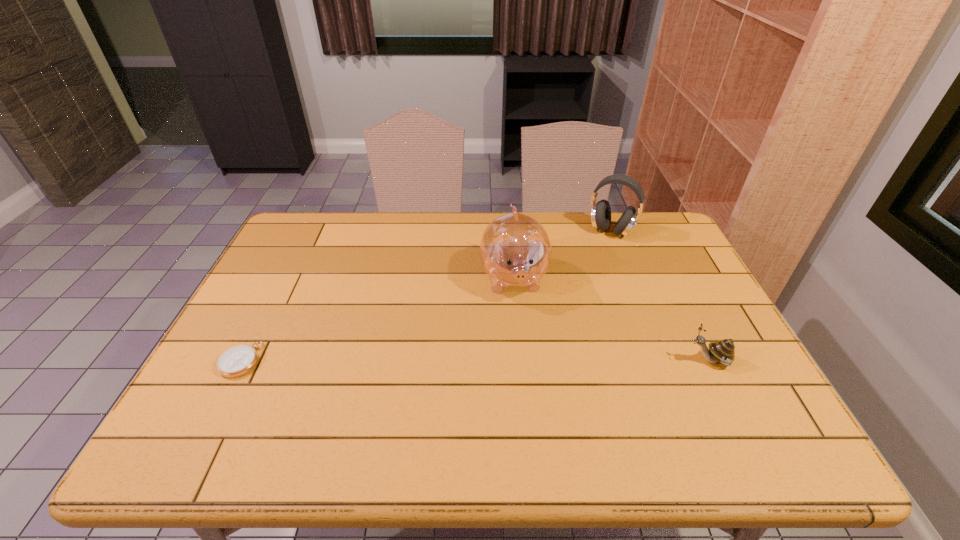
Find the location of a particular element. This screenshot has height=540, width=960. compass is located at coordinates (238, 360).

The image size is (960, 540). I want to click on the shortest object, so click(x=238, y=360).

You are a GUI agent. You are given a task and a screenshot of the screen. Output one action in this format:
    pyautogui.click(x=<x>, y=<y>)
    Task: Click on the snail
    
    Given the screenshot: What is the action you would take?
    pyautogui.click(x=723, y=351)

The image size is (960, 540). I want to click on the third object from right to left, so click(x=515, y=250).

I want to click on the third nearest object, so click(x=515, y=250).

Where is `the farthest object`? the farthest object is located at coordinates (600, 212).

At what (x,y) coordinates should I click in order to perform the action: click on free space located 0.210m on the right of the leftmost object. Please return your answer as a coordinate pair (x, y). Image resolution: width=960 pixels, height=540 pixels. Looking at the image, I should click on (344, 360).

This screenshot has width=960, height=540. In order to click on blank space located on the face of the snail in this screenshot , I will do `click(633, 360)`.

The image size is (960, 540). I want to click on blank space located on the face of the snail, so click(x=645, y=360).

This screenshot has height=540, width=960. Identify the location of free region located 0.400m on the face of the snail. (524, 360).